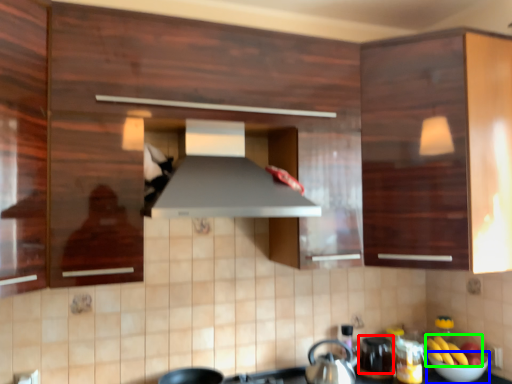
Question: Estimate the real-world distances between objects in this image. Which object is farther from appliance (highlighted by a red box), bowl (highlighted by a blue box) or banana (highlighted by a green box)?

Choices:
 (A) bowl
 (B) banana

Answer: (A)